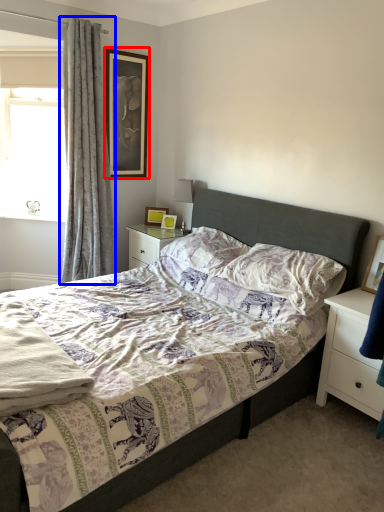
Question: Which of the following is the farthest to the observer, picture frame (highlighted by a red box) or curtain (highlighted by a blue box)?

Choices:
 (A) picture frame
 (B) curtain

Answer: (A)